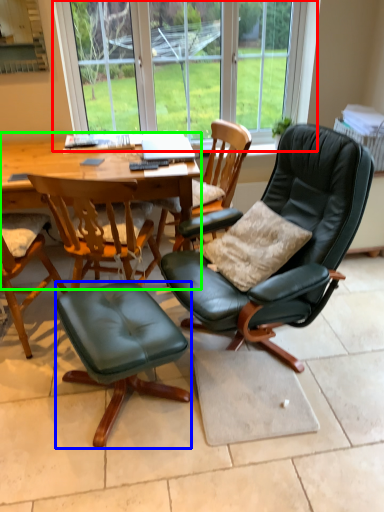
Question: Which is farther away from bay window (highlighted by a red box)? stool (highlighted by a blue box) or round table (highlighted by a green box)?

Choices:
 (A) stool
 (B) round table

Answer: (A)